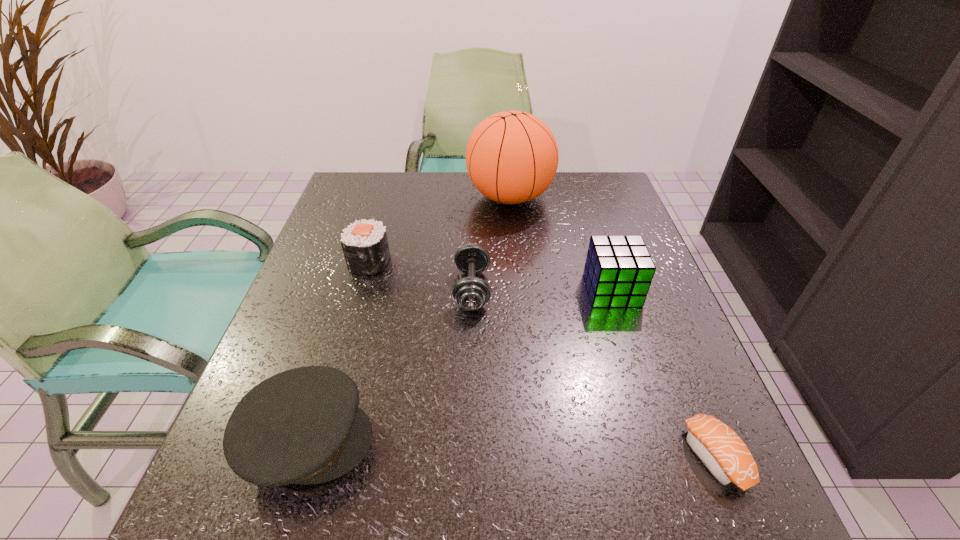
This screenshot has width=960, height=540. Identify the location of the tallest object. (512, 157).

Where is `the farthest object`? This screenshot has width=960, height=540. the farthest object is located at coordinates (512, 157).

Locate an element on the screen. cube is located at coordinates (618, 271).

The image size is (960, 540). Find the location of `the farther sushi`. the farther sushi is located at coordinates (365, 246).

I want to click on the taller sushi, so click(x=365, y=246).

Locate an element on the screen. This screenshot has height=540, width=960. beret is located at coordinates (303, 426).

Find the location of a particular element. The image size is (960, 540). the fifth tallest object is located at coordinates (471, 293).

You are a GUI agent. You are given a task and a screenshot of the screen. Output one action in this format:
    pyautogui.click(x=<x>, y=<y>)
    Task: Click on the shortest object
    
    Given the screenshot: What is the action you would take?
    click(x=720, y=449)

Image resolution: width=960 pixels, height=540 pixels. Identify the location of the right sushi. [x=720, y=449].

I want to click on free point located on the front of the basketball, so click(x=516, y=259).